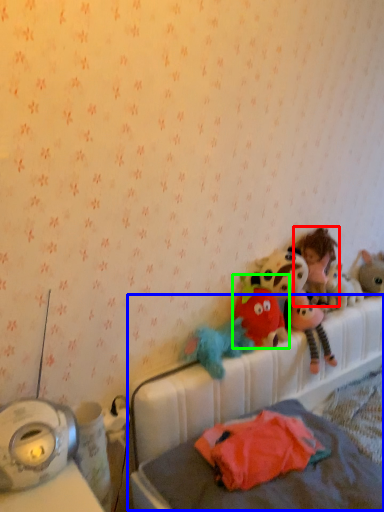
Question: Which object is positioned farthest from person (highlighted by a red box)? Select from hospital bed (highlighted by a blue box) and toy (highlighted by a green box).

Choices:
 (A) hospital bed
 (B) toy

Answer: (A)